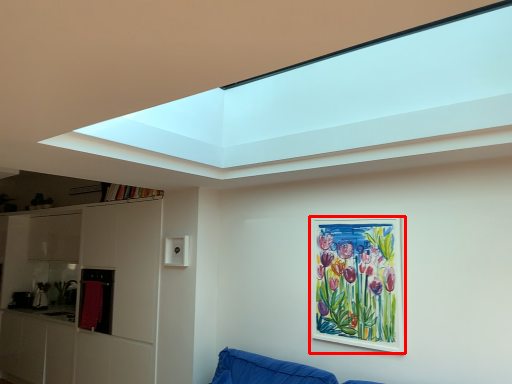
Question: Considering the relative positions of picture frame (annotated by the red box) and cabinet in the image provided, where is picture frame (annotated by the red box) located with respect to the staircase?

Choices:
 (A) right
 (B) left

Answer: (A)